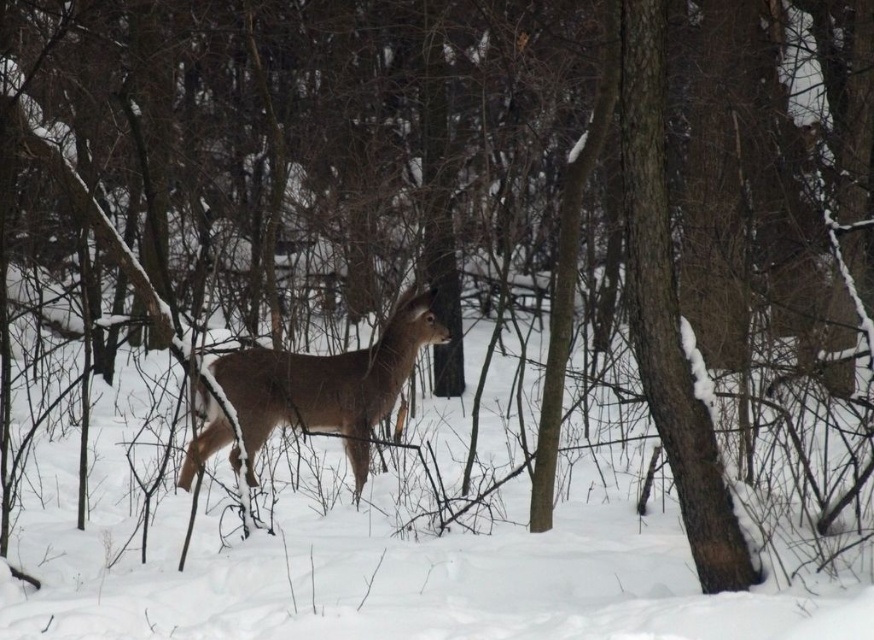
Does point (593, 497) lie in front of point (239, 419)?

No, it is behind (239, 419).

Image resolution: width=874 pixels, height=640 pixels. What are the coordinates of `white fluffy snow at center` in the screenshot? It's located at (387, 573).